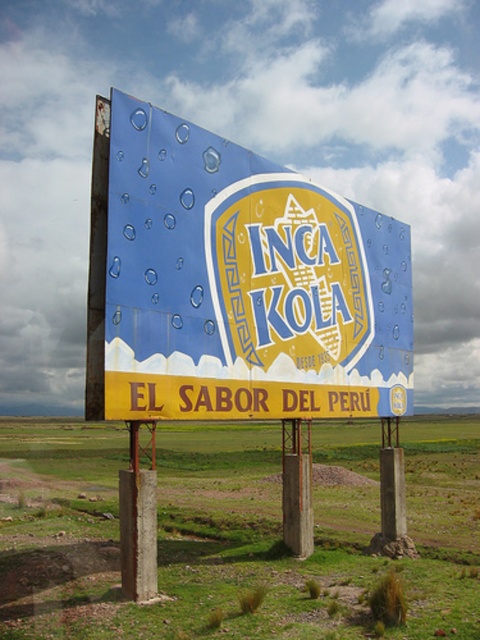
You are an artist planning to paint a mural inspired by the Inca Kola billboard. You need to know the relative sizes of the elements. Based on the image, which object is taller between the blue painted billboard at center and the yellow matte sign at center?

The blue painted billboard at center is taller than the yellow matte sign at center according to the description.

Based on the scene description, what is the 2D coordinate of the green grass at center?

The 2D coordinate of the green grass at center is at point (232, 531).

You are standing in front of the Inca Kola billboard and notice two points marked on it. The first point is at coordinates point (253, 176) and the second is at point (276, 339). Which point is closer to you?

Point (253, 176) is closer to the viewer than point (276, 339).